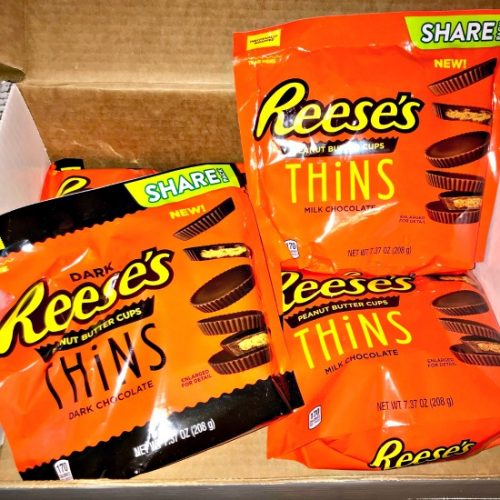
Locate an element on the screen. cups is located at coordinates click(133, 311).